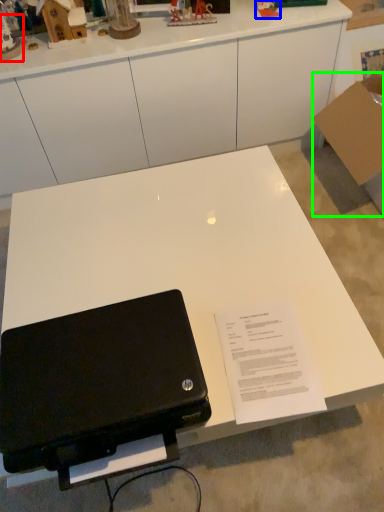
Question: Based on their relative distances, which object is nearer to toy (highlighted by a red box)? Choose from toy (highlighted by a blue box) and cardboard box (highlighted by a green box).

Choices:
 (A) toy
 (B) cardboard box

Answer: (A)